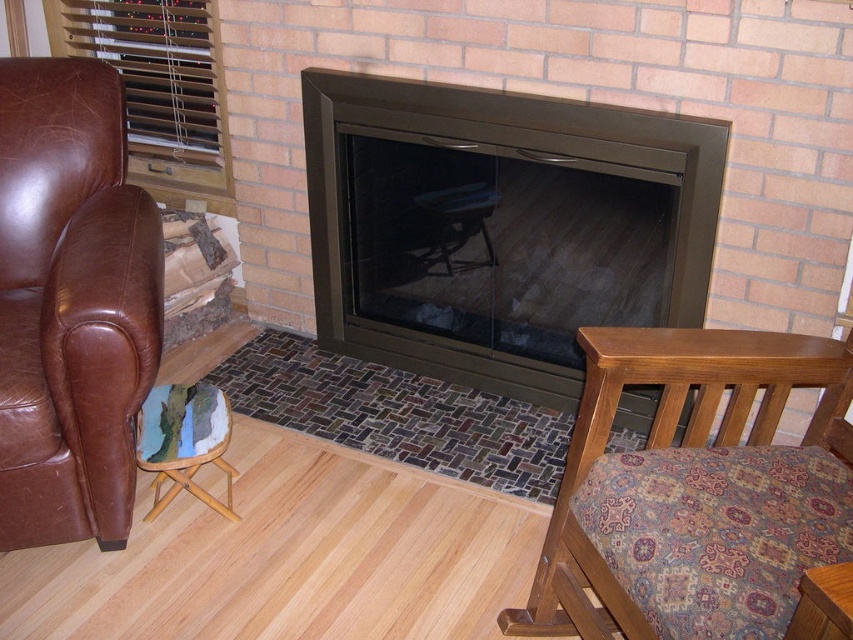
Between paisley fabric chair at lower right and light brown wood chair at lower right, which one is positioned lower?

light brown wood chair at lower right

Between paisley fabric chair at lower right and light brown wood chair at lower right, which one has less height?

With less height is light brown wood chair at lower right.

Image resolution: width=853 pixels, height=640 pixels. I want to click on paisley fabric chair at lower right, so click(x=695, y=492).

Can you confirm if brown leather armchair at left is positioned below light brown wood chair at lower right?

No, brown leather armchair at left is not below light brown wood chair at lower right.

Which is more to the left, brown leather armchair at left or light brown wood chair at lower right?

Positioned to the left is brown leather armchair at left.

Is point (67, 356) farther from viewer compared to point (846, 609)?

Yes, it is behind point (846, 609).

Locate an element on the screen. This screenshot has width=853, height=640. brown leather armchair at left is located at coordinates (71, 305).

Which is behind, point (378, 348) or point (747, 580)?

Point (378, 348)

Can you confirm if matte black fireplace at center is wider than paisley fabric chair at lower right?

Yes.

Is point (397, 321) farther from camera compared to point (606, 536)?

Yes, it is behind point (606, 536).

What are the coordinates of `matte black fireplace at center` in the screenshot? It's located at (500, 225).